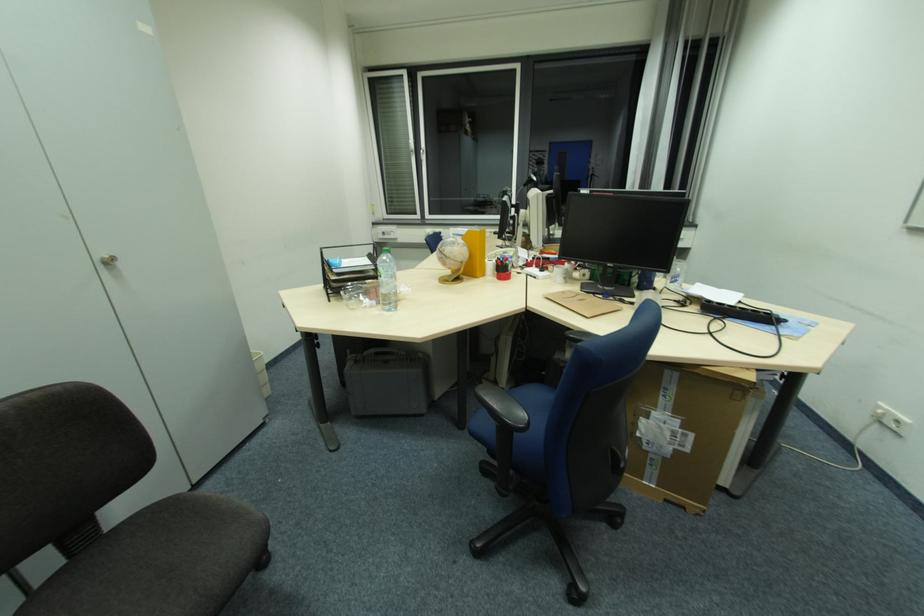
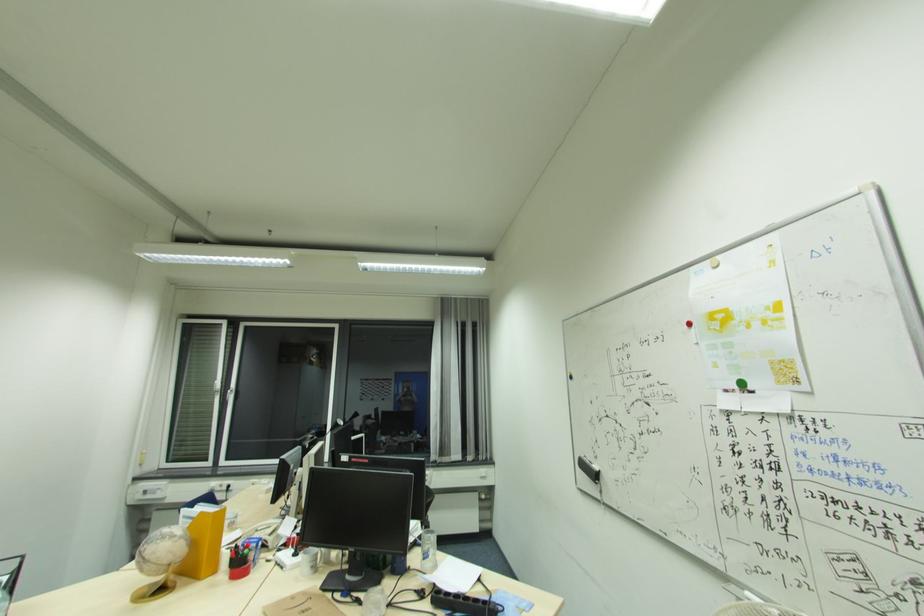
Where in the second image is the point corresponding to the point at 463,261 from the first image?

(167, 564)